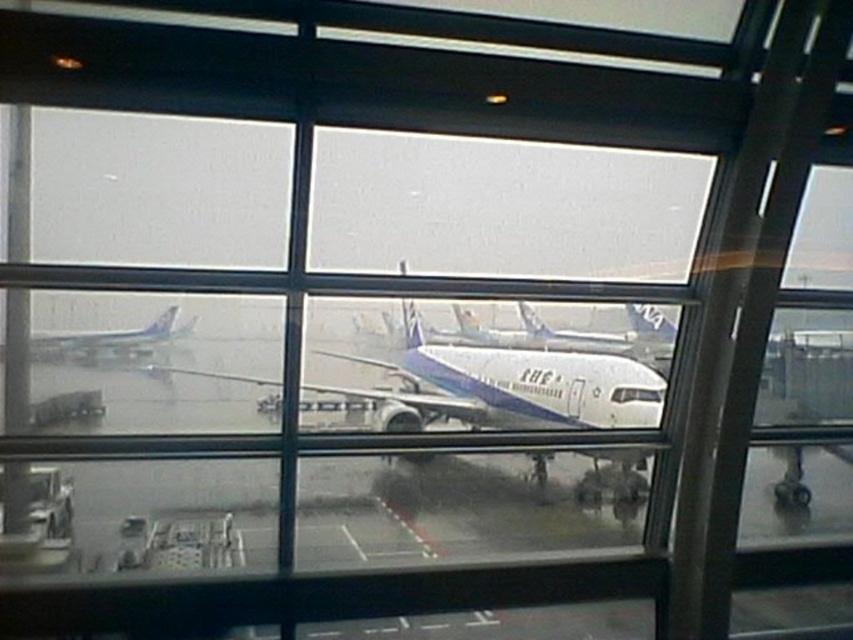
Question: Does white glossy airplane at center have a lesser width compared to white glossy airplane at left?

Choices:
 (A) no
 (B) yes

Answer: (A)

Question: Is white glossy airplane at center to the left of white glossy airplane at left from the viewer's perspective?

Choices:
 (A) no
 (B) yes

Answer: (A)

Question: Is white glossy airplane at center wider than white glossy airplane at left?

Choices:
 (A) yes
 (B) no

Answer: (A)